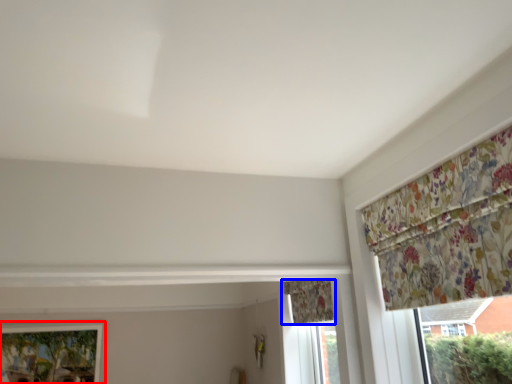
Question: Which object appears farthest to the camera in this image, window (highlighted by a red box) or curtain (highlighted by a blue box)?

Choices:
 (A) window
 (B) curtain

Answer: (A)